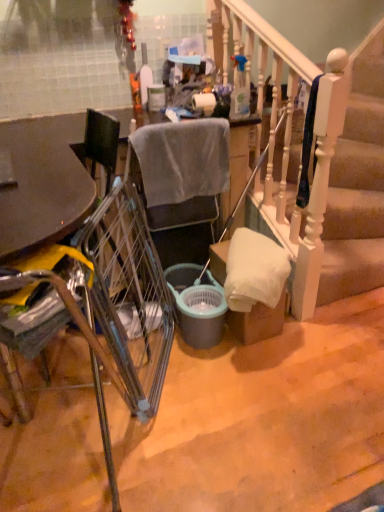
You are a GUI agent. You are given a task and a screenshot of the screen. Output one action in this format:
    pyautogui.click(x=<x>, y=<y>)
    Task: Click on the vacant area that is situated to the right of metallic silver chair at left, marked as the first chair in a front-to-back arrangement
    Image resolution: width=384 pixels, height=512 pixels.
    Given the screenshot: What is the action you would take?
    pyautogui.click(x=213, y=437)